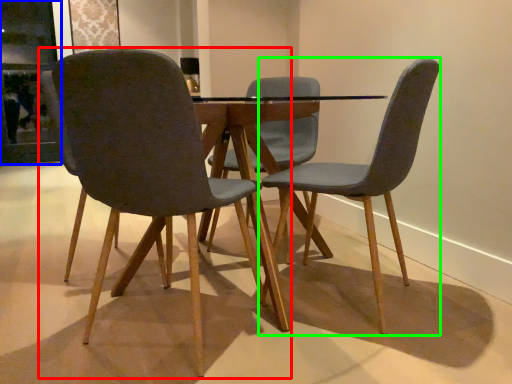
Question: Which object is positioned farthest from chair (highlighted by a red box)? Select from glass door (highlighted by a blue box) and chair (highlighted by a green box).

Choices:
 (A) glass door
 (B) chair

Answer: (A)